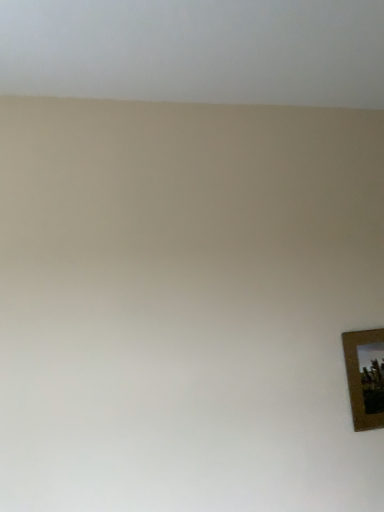
At what (x,y) coordinates should I click in order to perform the action: click on brown wooden picture frame at lower right. Please return your answer as a coordinate pair (x, y). The width and height of the screenshot is (384, 512). Looking at the image, I should click on (365, 378).

Describe the element at coordinates (365, 378) in the screenshot. I see `brown wooden picture frame at lower right` at that location.

At what (x,y) coordinates should I click in order to perform the action: click on brown wooden picture frame at lower right. Please return your answer as a coordinate pair (x, y). This screenshot has width=384, height=512. Looking at the image, I should click on (365, 378).